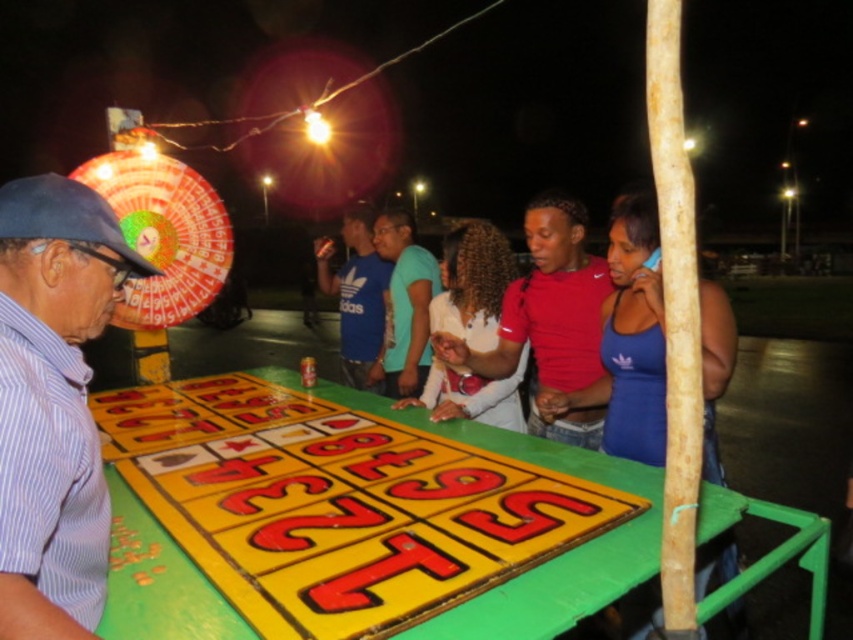
You are standing at the center of the image. Which direction should you move to locate the striped cotton shirt at left?

You should move to the left to locate the striped cotton shirt at left since it is positioned at point (53,403), which is on the left side of the image.